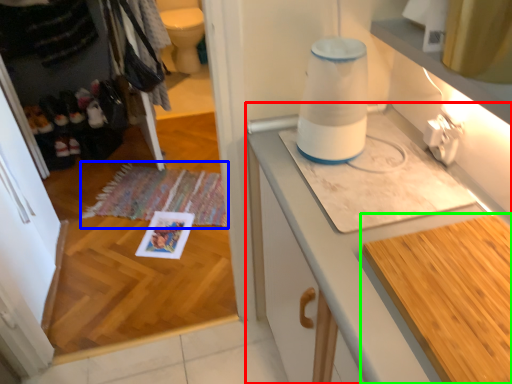
Question: Which object is positioned closest to cabinetry (highlighted by a red box)? Select from mat (highlighted by a blue box) and countertop (highlighted by a green box).

Choices:
 (A) mat
 (B) countertop

Answer: (B)